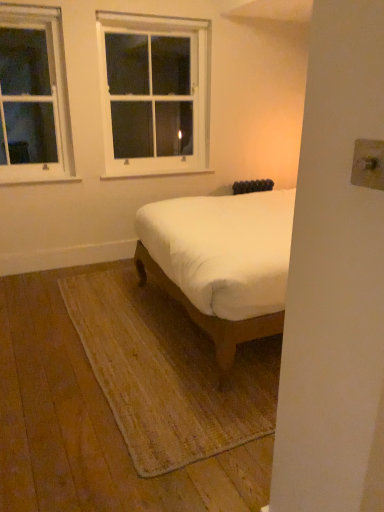
The height and width of the screenshot is (512, 384). I want to click on empty space that is ontop of white wood window at upper center, the 2th window positioned from the left (from a real-world perspective), so click(150, 10).